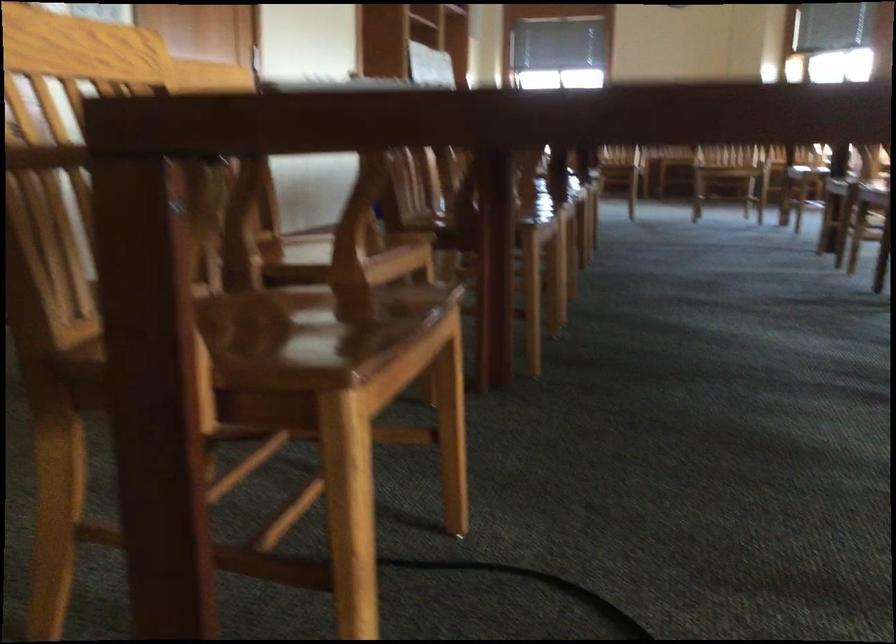
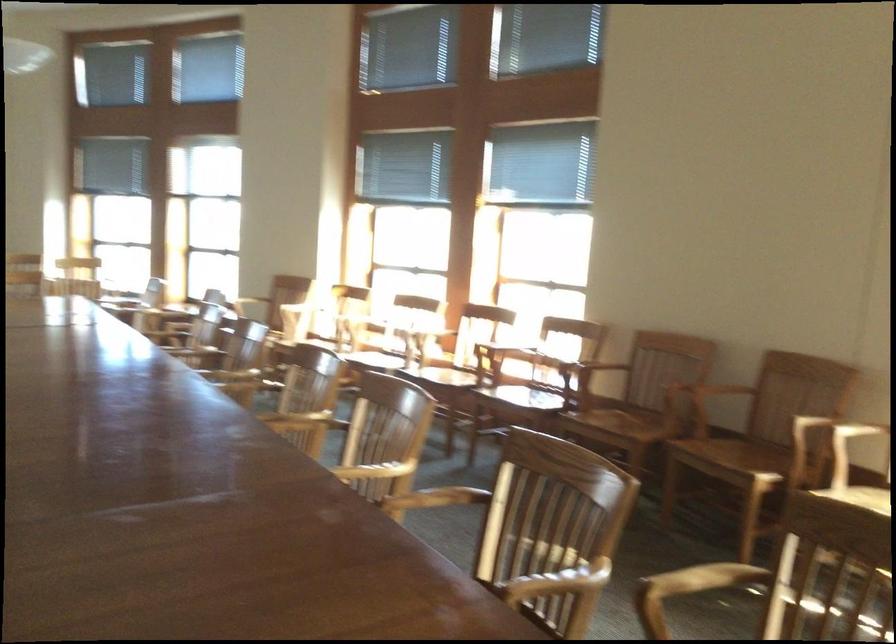
Question: Based on the continuous images, in which direction is the camera rotating? Reply with the corresponding letter.

Choices:
 (A) Left
 (B) Right
 (C) Up
 (D) Down

Answer: (B)